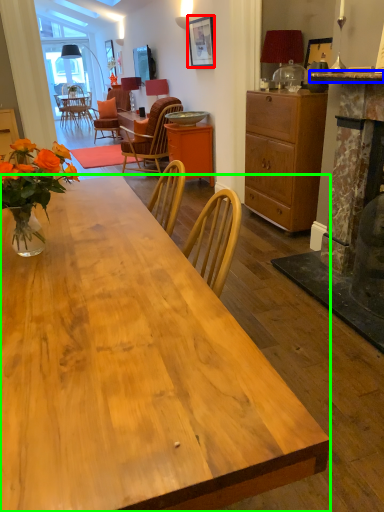
Question: Which object is the closest to the picture frame (highlighted by a red box)? Choose among these: counter top (highlighted by a blue box) or desk (highlighted by a green box).

Choices:
 (A) counter top
 (B) desk

Answer: (A)